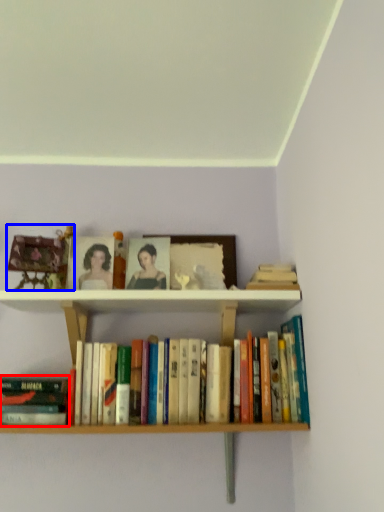
Question: Which object appears closest to the camera in this image, book (highlighted by a red box) or toy (highlighted by a blue box)?

Choices:
 (A) book
 (B) toy

Answer: (A)